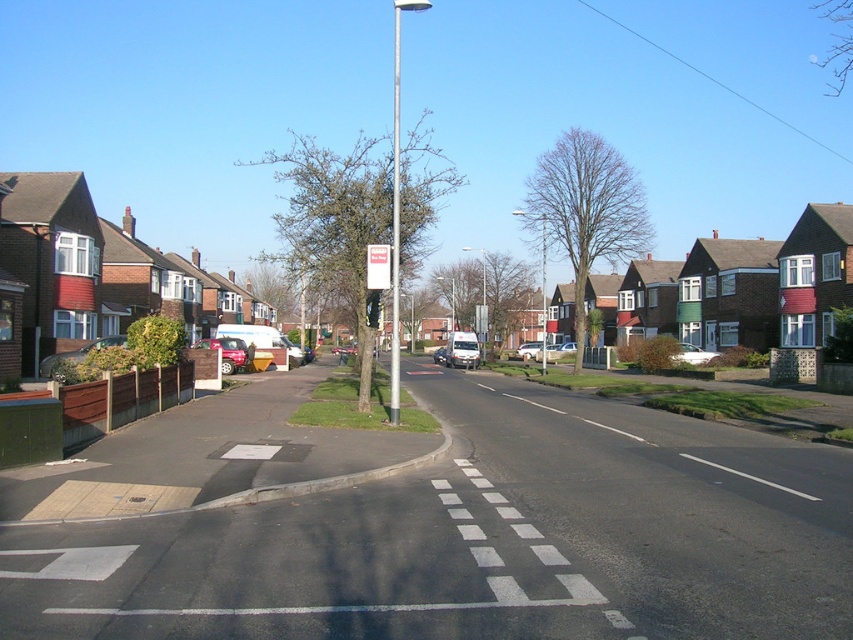
You are a pedestrian standing on the sidewalk and want to cross the street using the crosswalk at the bottom left corner. You notice the silver metallic pole at center and the metallic traffic light at center. Which object is closer to you?

The silver metallic pole at center is closer to the viewer than the metallic traffic light at center.

You are a pedestrian standing at the crosswalk at the bottom left corner of the image. You see the metallic red car at left and the silver metallic car at center. Which car is positioned higher in the image?

The metallic red car at left is positioned higher in the image than the silver metallic car at center.

You are a delivery driver who needs to park your vehicle on the black asphalt road at center. There is a white plastic sign at center nearby. Can you fit your vehicle there without overlapping the sign?

The black asphalt road at center is larger in size than the white plastic sign at center, so yes, you can park your vehicle there without overlapping the sign as there is enough space.